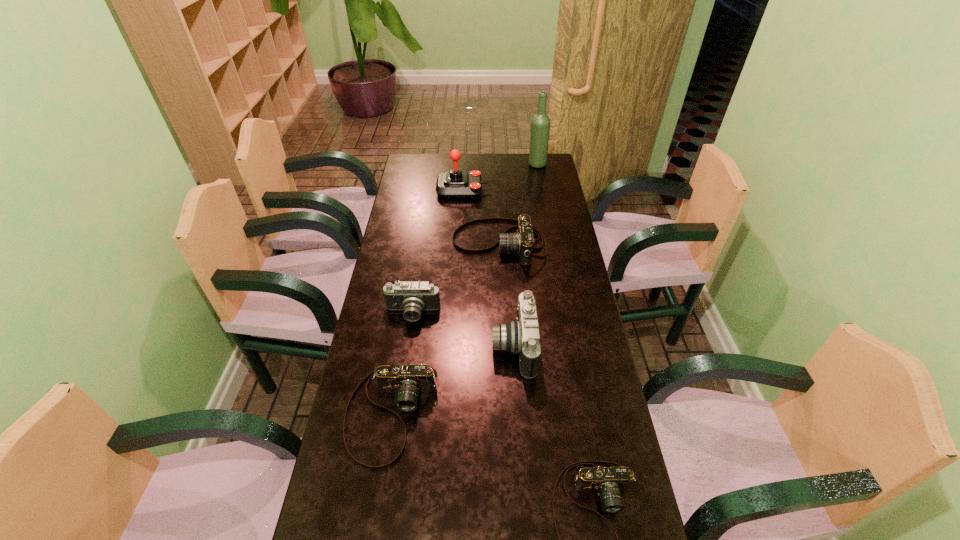
Where is `vacant point located between the farthest camera and the joystick`? vacant point located between the farthest camera and the joystick is located at coordinates (480, 217).

Locate an element on the screen. The width and height of the screenshot is (960, 540). unoccupied area between the right black camera and the second tallest object is located at coordinates (488, 268).

Identify which object is the third closest to the smaller black camera. Please provide its 2D coordinates. Your answer should be formatted as a tuple, i.e. [(x, y)], where the tuple contains the x and y coordinates of a point satisfying the conditions above.

[(522, 241)]

You are a GUI agent. You are given a task and a screenshot of the screen. Output one action in this format:
    pyautogui.click(x=<x>, y=<y>)
    Task: Click on the object that is the closest to the second farthest object
    The width and height of the screenshot is (960, 540).
    Given the screenshot: What is the action you would take?
    pyautogui.click(x=522, y=241)

Where is `the second closest camera to the second shortest object`? Image resolution: width=960 pixels, height=540 pixels. the second closest camera to the second shortest object is located at coordinates (412, 297).

Identify which camera is the fourth closest to the shortest object. Please provide its 2D coordinates. Your answer should be formatted as a tuple, i.e. [(x, y)], where the tuple contains the x and y coordinates of a point satisfying the conditions above.

[(522, 241)]

Select which brown camera appears as the second closest to the second biggest brown camera. Please provide its 2D coordinates. Your answer should be formatted as a tuple, i.e. [(x, y)], where the tuple contains the x and y coordinates of a point satisfying the conditions above.

[(522, 241)]

Choose which brown camera is the second nearest neighbor to the farthest brown camera. Please provide its 2D coordinates. Your answer should be formatted as a tuple, i.e. [(x, y)], where the tuple contains the x and y coordinates of a point satisfying the conditions above.

[(608, 481)]

The width and height of the screenshot is (960, 540). Find the location of `free region that satisfies the following two spatial constraints: 1. on the front-facing side of the farthest camera; 2. on the front-facing side of the second smallest brown camera`. free region that satisfies the following two spatial constraints: 1. on the front-facing side of the farthest camera; 2. on the front-facing side of the second smallest brown camera is located at coordinates (507, 414).